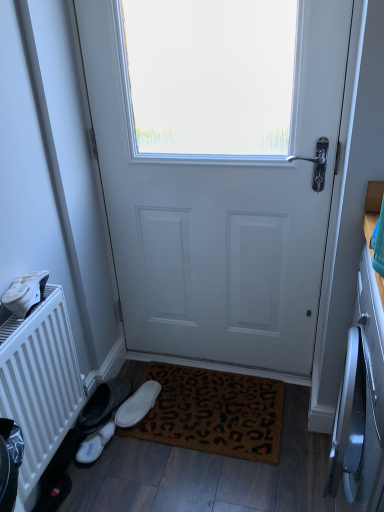
Question: Considering the positions of white matte door at center and white suede slippers at lower left, the 1th footwear from the left, in the image, is white matte door at center bigger or smaller than white suede slippers at lower left, the 1th footwear from the left,?

Choices:
 (A) small
 (B) big

Answer: (B)

Question: From the image's perspective, is white matte door at center above or below white suede slippers at lower left, the 1th footwear from the left?

Choices:
 (A) below
 (B) above

Answer: (B)

Question: Considering the real-world distances, which object is farthest from the white matte door at center?

Choices:
 (A) white suede slippers at lower left, arranged as the 2th footwear when viewed from the right
 (B) white suede slipper at lower left, marked as the second footwear in a left-to-right arrangement
 (C) white matte radiator at left
 (D) brown coir doormat at lower center

Answer: (A)

Question: Based on their relative distances, which object is nearer to the white suede slippers at lower left, arranged as the 2th footwear when viewed from the right?

Choices:
 (A) white matte radiator at left
 (B) white matte door at center
 (C) white suede slipper at lower left, the first footwear from the right
 (D) brown coir doormat at lower center

Answer: (C)